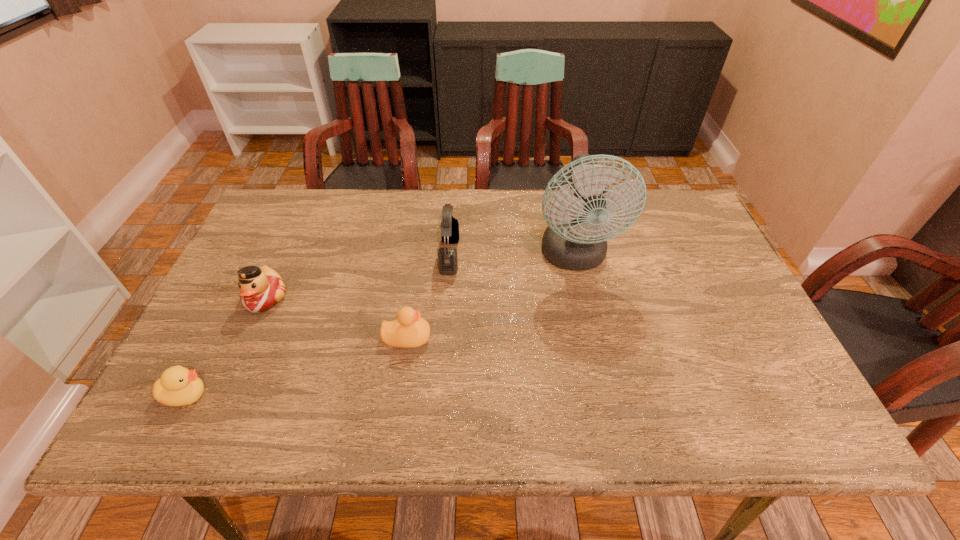
Locate an element on the screen. This screenshot has height=540, width=960. vacant space at the right edge of the desktop is located at coordinates (691, 290).

The width and height of the screenshot is (960, 540). I want to click on free space at the near right corner of the desktop, so click(814, 435).

Locate an element on the screen. vacant area between the fourth shortest object and the farthest duck is located at coordinates (358, 277).

Find the location of a particular element. The height and width of the screenshot is (540, 960). free point between the rightmost object and the farthest duck is located at coordinates (420, 278).

Locate an element on the screen. This screenshot has height=540, width=960. vacant point located between the farthest duck and the third object from right to left is located at coordinates (336, 318).

Identify the location of free spot between the fourth object from left to right and the nearest object. The height and width of the screenshot is (540, 960). (318, 326).

I want to click on blank region between the headset and the nearest duck, so click(318, 326).

Where is `free space between the farthest duck and the nearest object`? This screenshot has height=540, width=960. free space between the farthest duck and the nearest object is located at coordinates (226, 347).

At what (x,y) coordinates should I click in order to perform the action: click on free space between the fan and the headset. Please return your answer as a coordinate pair (x, y). Image resolution: width=960 pixels, height=540 pixels. Looking at the image, I should click on (513, 256).

Image resolution: width=960 pixels, height=540 pixels. I want to click on free space between the farthest duck and the rightmost duck, so click(336, 318).